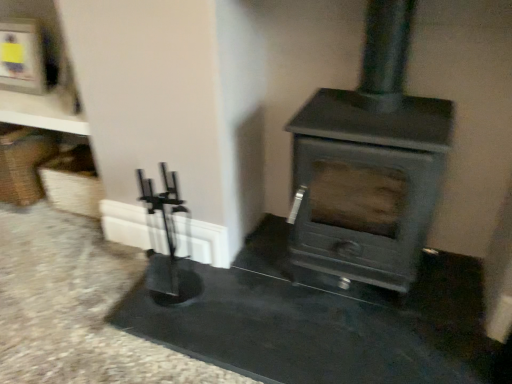
Measure the distance between matte gray wood burning stove at right and camera.

matte gray wood burning stove at right is 1.05 meters from camera.

What do you see at coordinates (369, 165) in the screenshot? I see `matte gray wood burning stove at right` at bounding box center [369, 165].

Where is `matte gray wood burning stove at right`? The height and width of the screenshot is (384, 512). matte gray wood burning stove at right is located at coordinates (369, 165).

Where is `matte gray wood burning stove at right`? matte gray wood burning stove at right is located at coordinates (369, 165).